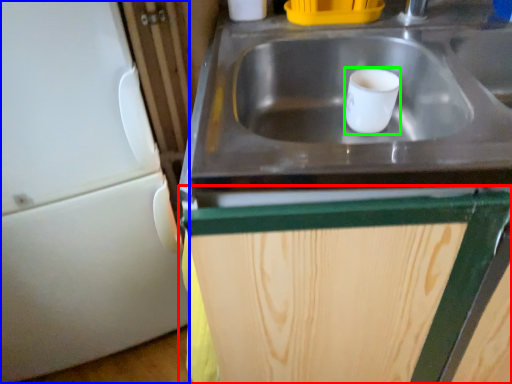
Question: Estimate the real-world distances between objects in this image. Which object is closer to cabinetry (highlighted by a red box), appliance (highlighted by a blue box) or mug (highlighted by a green box)?

Choices:
 (A) appliance
 (B) mug

Answer: (B)